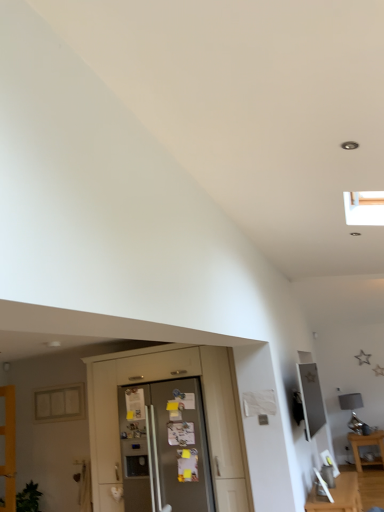
Identify the location of satin silver refrigerator at center. (204, 410).

The image size is (384, 512). What do you see at coordinates (165, 450) in the screenshot?
I see `satin silver refrigerator at center` at bounding box center [165, 450].

The image size is (384, 512). I want to click on wooden table at lower right, so click(366, 445).

Considering the relative sizes of satin silver refrigerator at center and wooden door at left in the image provided, is satin silver refrigerator at center taller than wooden door at left?

No.

Which is nearer, (202, 437) or (5, 490)?

The point (202, 437) is closer.

Looking at this image, is there a large distance between satin silver refrigerator at center and wooden door at left?

Yes, satin silver refrigerator at center and wooden door at left are located far from each other.

From the image's perspective, who appears lower, satin silver refrigerator at center or wooden door at left?

wooden door at left appears lower in the image.

Is satin silver refrigerator at center facing away from satin silver refrigerator at center?

Yes, satin silver refrigerator at center is positioned with its back facing satin silver refrigerator at center.

Is satin silver refrigerator at center further to the viewer compared to satin silver refrigerator at center?

No, it is not.

Based on the photo, between satin silver refrigerator at center and satin silver refrigerator at center, which one has smaller size?

satin silver refrigerator at center.

Is there a large distance between satin silver refrigerator at center and satin silver refrigerator at center?

No, satin silver refrigerator at center is not far away from satin silver refrigerator at center.

Does satin silver refrigerator at center have a lesser height compared to satin silver refrigerator at center?

Correct, satin silver refrigerator at center is not as tall as satin silver refrigerator at center.

In the scene shown: Which is closer, (164, 477) or (174, 344)?

Point (164, 477) is positioned closer to the camera compared to point (174, 344).

Is satin silver refrigerator at center next to satin silver refrigerator at center?

No, satin silver refrigerator at center is not making contact with satin silver refrigerator at center.

Between satin silver refrigerator at center and metallic silver frame at upper right, which one has larger size?

Bigger between the two is satin silver refrigerator at center.

Can you confirm if satin silver refrigerator at center is taller than metallic silver frame at upper right?

Yes.

Is satin silver refrigerator at center oriented towards metallic silver frame at upper right?

No, satin silver refrigerator at center is not turned towards metallic silver frame at upper right.

Considering the sizes of objects metallic silver frame at upper right and wooden door at left in the image provided, who is smaller, metallic silver frame at upper right or wooden door at left?

metallic silver frame at upper right is smaller.

Is metallic silver frame at upper right positioned with its back to wooden door at left?

Absolutely, metallic silver frame at upper right is directed away from wooden door at left.

From the image's perspective, does metallic silver frame at upper right appear higher than wooden door at left?

Yes.

From a real-world perspective, relative to wooden door at left, is metallic silver frame at upper right vertically above or below?

metallic silver frame at upper right is above wooden door at left.

Is wooden table at lower right completely or partially inside wooden door at left?

Actually, wooden table at lower right is outside wooden door at left.

Considering the positions of point (11, 482) and point (351, 445), is point (11, 482) closer or farther from the camera than point (351, 445)?

Point (11, 482).

How distant is wooden door at left from wooden table at lower right?

wooden door at left is 14.79 feet from wooden table at lower right.

Identify the location of table on the right side of wooden door at left. The image size is (384, 512). (366, 445).

Which object is further away from the camera, wooden table at lower right or metallic silver frame at upper right?

Positioned behind is wooden table at lower right.

Considering the sizes of wooden table at lower right and metallic silver frame at upper right in the image, is wooden table at lower right wider or thinner than metallic silver frame at upper right?

Considering their sizes, wooden table at lower right looks broader than metallic silver frame at upper right.

Is metallic silver frame at upper right completely or partially inside wooden table at lower right?

No, metallic silver frame at upper right is not surrounded by wooden table at lower right.

Where is `door on the left side of satin silver refrigerator at center`? door on the left side of satin silver refrigerator at center is located at coordinates (9, 448).

Locate an element on the screen. Image resolution: width=384 pixels, height=512 pixels. dresser above the satin silver refrigerator at center (from the image's perspective) is located at coordinates (204, 410).

Looking at the image, which one is located closer to wooden table at lower right, satin silver refrigerator at center or metallic silver frame at upper right?

metallic silver frame at upper right lies closer to wooden table at lower right than the other object.

Estimate the real-world distances between objects in this image. Which object is further from wooden table at lower right, metallic silver frame at upper right or wooden door at left?

Based on the image, wooden door at left appears to be further to wooden table at lower right.

Consider the image. Considering their positions, is wooden table at lower right positioned closer to matte glass window at left than satin silver refrigerator at center?

satin silver refrigerator at center is positioned closer to the anchor matte glass window at left.

Considering their positions, is metallic silver frame at upper right positioned further to satin silver refrigerator at center than wooden door at left?

Among the two, wooden door at left is located further to satin silver refrigerator at center.

From the image, which object appears to be farther from matte glass window at left, metallic silver frame at upper right or wooden table at lower right?

wooden table at lower right lies further to matte glass window at left than the other object.

Looking at this image, considering their positions, is wooden door at left positioned further to wooden table at lower right than satin silver refrigerator at center?

Based on the image, wooden door at left appears to be further to wooden table at lower right.

Which object lies further to the anchor point satin silver refrigerator at center, wooden door at left or wooden table at lower right?

wooden table at lower right.

When comparing their distances from wooden table at lower right, does satin silver refrigerator at center or wooden door at left seem further?

The object further to wooden table at lower right is wooden door at left.

The image size is (384, 512). Identify the location of window situated between wooden door at left and satin silver refrigerator at center from left to right. (59, 403).

Where is `dresser located between wooden door at left and metallic silver frame at upper right in the left-right direction`? This screenshot has width=384, height=512. dresser located between wooden door at left and metallic silver frame at upper right in the left-right direction is located at coordinates (204, 410).

This screenshot has width=384, height=512. Identify the location of screen door between matte glass window at left and wooden table at lower right. pyautogui.click(x=165, y=450).

This screenshot has height=512, width=384. What are the coordinates of `screen door situated between satin silver refrigerator at center and wooden table at lower right from left to right` in the screenshot? It's located at (165, 450).